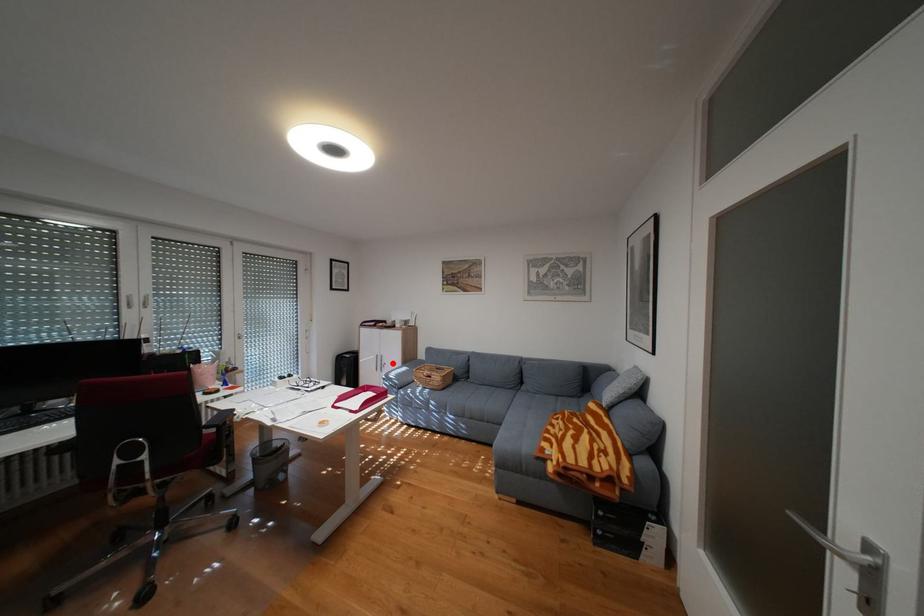
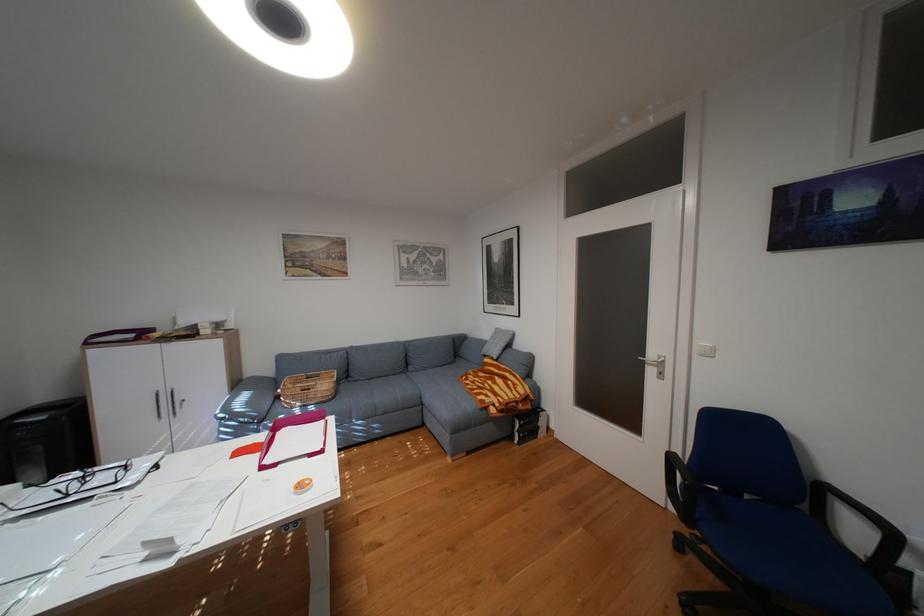
Question: I am providing you with two images of the same scene from different viewpoints. Image1 has a red point marked. In image2, the corresponding 3D location appears at what relative position? Reply with the corresponding letter.

Choices:
 (A) Closer
 (B) Farther

Answer: (A)